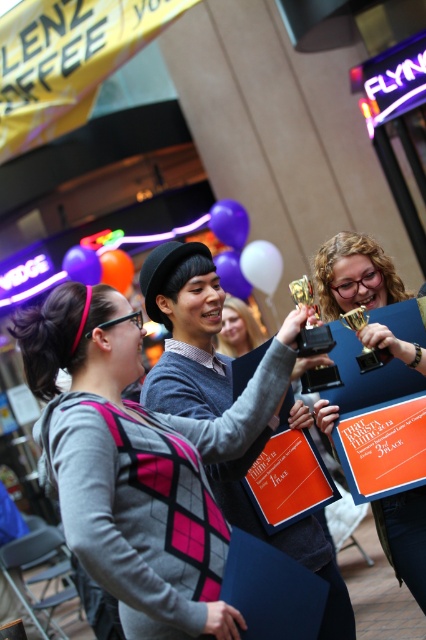
Question: Which point is closer to the camera?

Choices:
 (A) matte gray sweater at center
 (B) pink diamond-patterned sweater at center

Answer: (B)

Question: Which point is closer to the camera?

Choices:
 (A) (334, 412)
 (B) (227, 353)

Answer: (A)

Question: Where is pink diamond-patterned sweater at center located in relation to shiny gold trophy at center in the image?

Choices:
 (A) below
 (B) above

Answer: (A)

Question: Does shiny gold trophy at center have a lesser width compared to matte gray sweater at center?

Choices:
 (A) no
 (B) yes

Answer: (A)

Question: Is shiny gold trophy at center to the right of matte gray sweater at center from the viewer's perspective?

Choices:
 (A) yes
 (B) no

Answer: (A)

Question: Among these points, which one is nearest to the camera?

Choices:
 (A) (245, 339)
 (B) (356, 237)

Answer: (B)